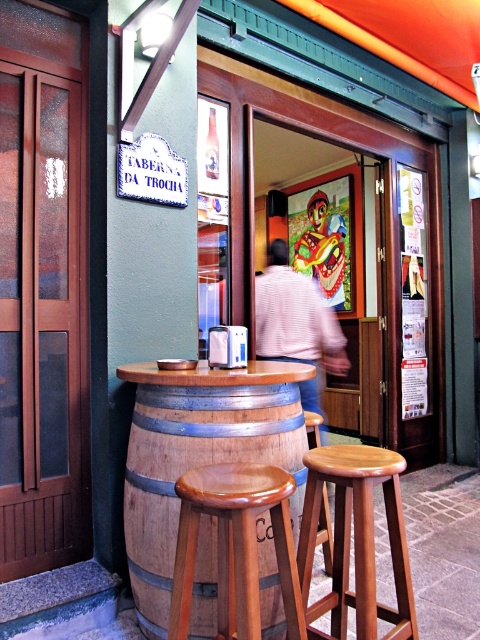
Question: Which object is positioned closest to the wooden bar stool at center?

Choices:
 (A) translucent glass bottle at center
 (B) shiny brown wood stool at center
 (C) matte plastic mask at center

Answer: (B)

Question: Does wooden barrel at center lie in front of shiny brown wood stool at center?

Choices:
 (A) yes
 (B) no

Answer: (B)

Question: From the image, what is the correct spatial relationship of shiny brown wood stool at center in relation to matte plastic mask at center?

Choices:
 (A) right
 (B) left

Answer: (B)

Question: Does wooden barrel at center have a lesser width compared to translucent glass bottle at center?

Choices:
 (A) no
 (B) yes

Answer: (A)

Question: Which of the following is the closest to the observer?

Choices:
 (A) (292, 476)
 (B) (266, 604)

Answer: (A)

Question: Which object is the closest to the translucent glass bottle at center?

Choices:
 (A) matte plastic mask at center
 (B) light pink sweater at center

Answer: (B)